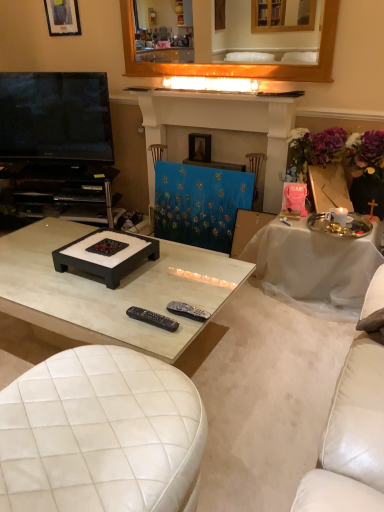
At what (x,y) coordinates should I click in order to perform the action: click on free space below flat screen tv at left (from a real-world perspective). Please return your answer as a coordinate pair (x, y). The width and height of the screenshot is (384, 512). Looking at the image, I should click on (57, 175).